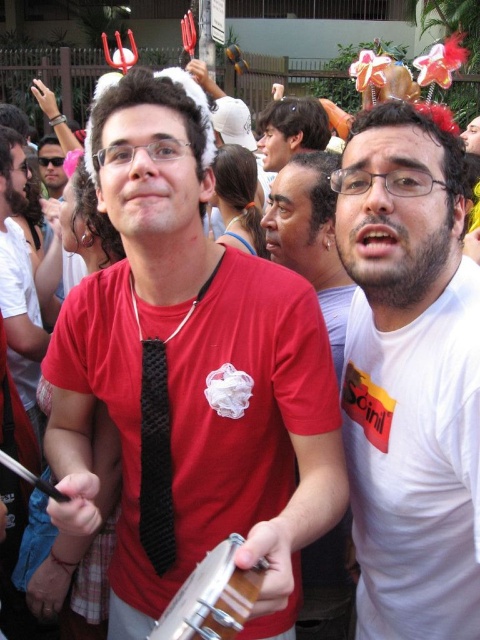
Question: Which object is positioned farthest from the black textured tie at center?

Choices:
 (A) wooden drum at center
 (B) white matte shirt at center

Answer: (B)

Question: Can you confirm if white matte shirt at center is smaller than black textured tie at center?

Choices:
 (A) no
 (B) yes

Answer: (A)

Question: Does white matte shirt at center appear on the left side of matte white wig at center?

Choices:
 (A) yes
 (B) no

Answer: (B)

Question: Which point is closer to the camera taking this photo?

Choices:
 (A) coord(309,138)
 (B) coord(163,634)
 (C) coord(317,632)
 (D) coord(406,132)

Answer: (B)

Question: Which object appears closest to the camera in this image?

Choices:
 (A) matte black tie at center
 (B) wooden drum at center
 (C) matte white wig at center

Answer: (B)

Question: From the image, what is the correct spatial relationship of matte black tie at center in relation to smooth white shirt at center?

Choices:
 (A) left
 (B) right

Answer: (A)